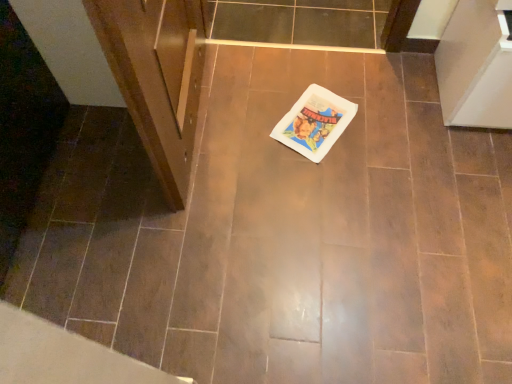
Question: Should I look upward or downward to see white glossy cabinet at right?

Choices:
 (A) up
 (B) down

Answer: (A)